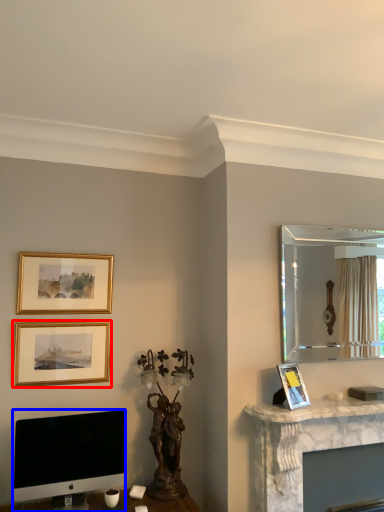
Question: Which of the following is the closest to the observer, picture frame (highlighted by a red box) or computer monitor (highlighted by a blue box)?

Choices:
 (A) picture frame
 (B) computer monitor

Answer: (B)